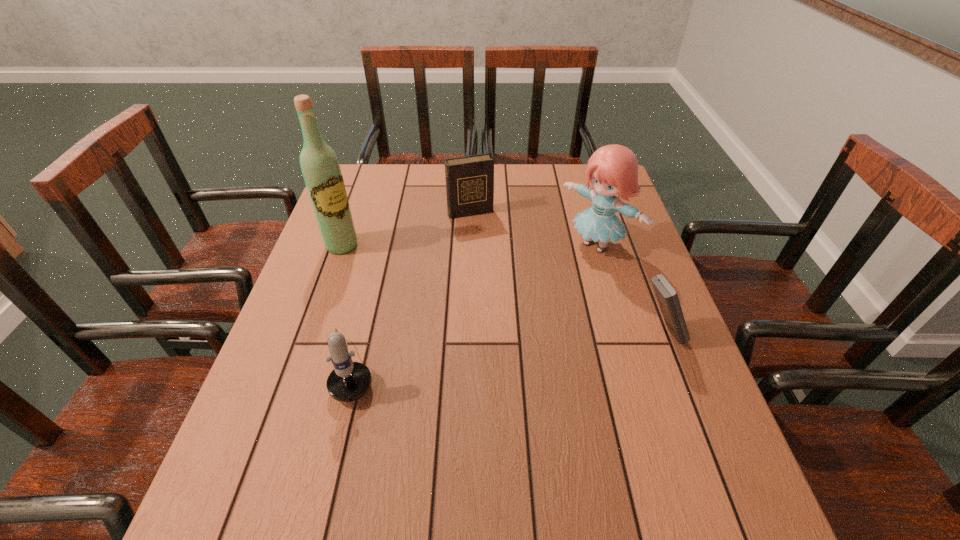
Identify the location of vacant point that satisfies the following two spatial constraints: 1. on the front side of the wine bottle; 2. on the front-facing side of the calculator. The width and height of the screenshot is (960, 540). [x=312, y=333].

This screenshot has width=960, height=540. I want to click on vacant space that satisfies the following two spatial constraints: 1. on the front side of the calculator; 2. on the front-facing side of the diary, so click(468, 333).